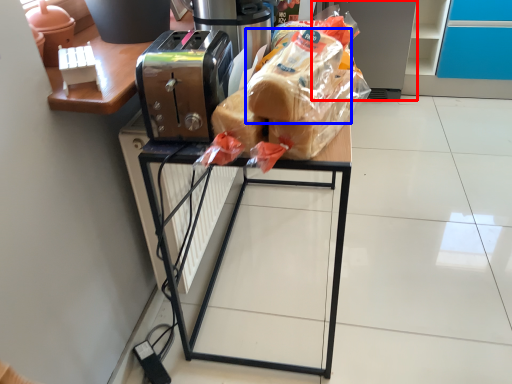
Question: Which of the following is the closest to the observer, appliance (highlighted by a red box) or bread (highlighted by a blue box)?

Choices:
 (A) appliance
 (B) bread

Answer: (B)